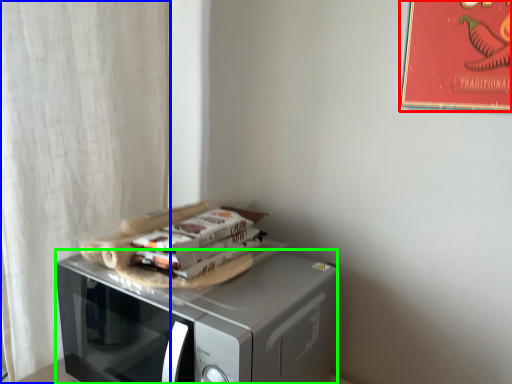
Question: Based on their relative distances, which object is nearer to bulletin board (highlighted by a red box)? Choose from curtain (highlighted by a blue box) and microwave oven (highlighted by a green box).

Choices:
 (A) curtain
 (B) microwave oven

Answer: (B)